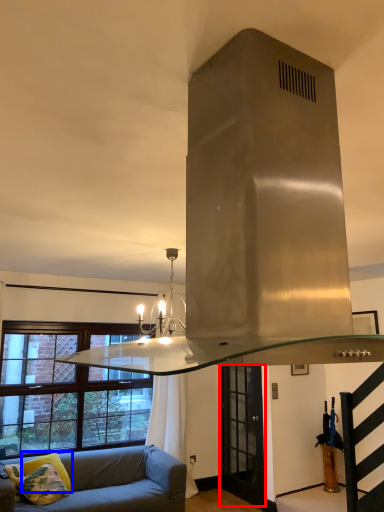
Question: Among these objects, which one is nearest to the camera, glass door (highlighted by a red box) or pillow (highlighted by a blue box)?

Choices:
 (A) glass door
 (B) pillow

Answer: (B)